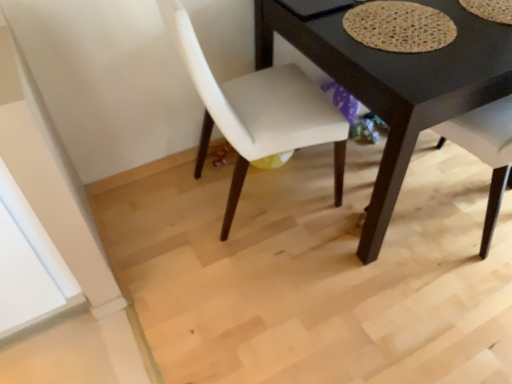
Locate an element on the screen. This screenshot has height=384, width=512. vacant area that is in front of textured beige mat at upper right is located at coordinates (430, 74).